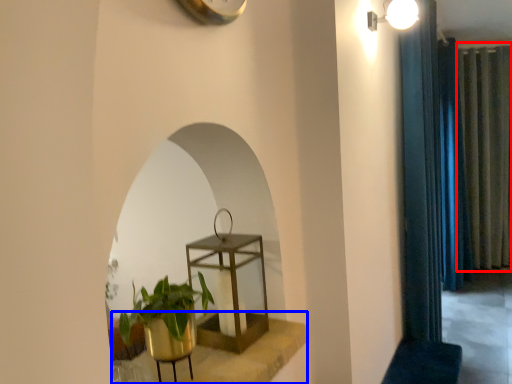
Question: Among these objects, which one is farthest to the camera, curtain (highlighted by a red box) or window sill (highlighted by a blue box)?

Choices:
 (A) curtain
 (B) window sill

Answer: (A)